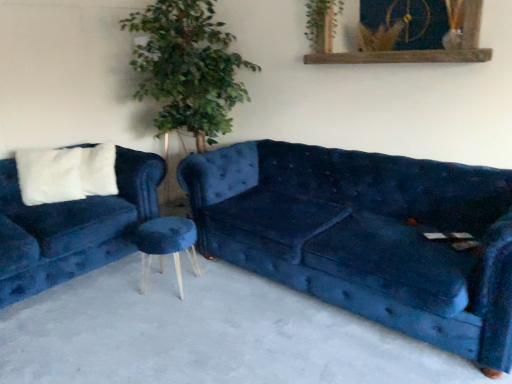
The height and width of the screenshot is (384, 512). What do you see at coordinates (410, 50) in the screenshot? I see `rustic wood picture frame at upper center` at bounding box center [410, 50].

Locate an element on the screen. The height and width of the screenshot is (384, 512). velvet blue stool at center is located at coordinates (166, 246).

The image size is (512, 384). What do you see at coordinates (72, 227) in the screenshot?
I see `velvet blue couch at left, which is the first studio couch from left to right` at bounding box center [72, 227].

Find the location of `rustic wood picture frame at upper center`. rustic wood picture frame at upper center is located at coordinates (410, 50).

Is rustic wood picture frame at upper center thinner than white fluffy pillow at left?

Yes, rustic wood picture frame at upper center is thinner than white fluffy pillow at left.

Measure the distance from rustic wood picture frame at upper center to white fluffy pillow at left.

rustic wood picture frame at upper center and white fluffy pillow at left are 5.69 feet apart.

Could you tell me if rustic wood picture frame at upper center is turned towards white fluffy pillow at left?

No.

Considering the sizes of objects rustic wood picture frame at upper center and white fluffy pillow at left in the image provided, who is taller, rustic wood picture frame at upper center or white fluffy pillow at left?

Standing taller between the two is white fluffy pillow at left.

From a real-world perspective, who is located lower, white fluffy pillow at left or velvet blue couch at center?

velvet blue couch at center, from a real-world perspective.

Is white fluffy pillow at left facing towards velvet blue couch at center?

No, white fluffy pillow at left is not aimed at velvet blue couch at center.

Can you confirm if white fluffy pillow at left is shorter than velvet blue couch at center?

Incorrect, the height of white fluffy pillow at left does not fall short of that of velvet blue couch at center.

This screenshot has height=384, width=512. In the image, there is a white fluffy pillow at left. Find the location of `concrete below it (from a real-world perspective)`. concrete below it (from a real-world perspective) is located at coordinates (206, 334).

Between point (88, 186) and point (195, 275), which one is positioned in front?

Positioned in front is point (195, 275).

Is white fluffy pillow at left positioned with its back to velvet blue stool at center?

No, white fluffy pillow at left is not facing away from velvet blue stool at center.

Based on the photo, what's the angular difference between white fluffy pillow at left and velvet blue stool at center's facing directions?

The angular difference between white fluffy pillow at left and velvet blue stool at center is 22.7 degrees.

In the image, is white fluffy pillow at left on the left side or the right side of velvet blue stool at center?

Based on their positions, white fluffy pillow at left is located to the left of velvet blue stool at center.

Which object is further away from the camera taking this photo, velvet blue couch at left, arranged as the 2th studio couch when viewed from the right, or green leafy plant at upper center?

green leafy plant at upper center is further from the camera.

Considering the positions of points (55, 272) and (321, 3), is point (55, 272) farther from camera compared to point (321, 3)?

That is False.

Locate an element on the screen. The height and width of the screenshot is (384, 512). studio couch located on the left of green leafy plant at upper center is located at coordinates coord(72,227).

Would you say green leafy plant at upper center is part of velvet blue couch at left, which is the first studio couch from left to right,'s contents?

That's incorrect, green leafy plant at upper center is not inside velvet blue couch at left, which is the first studio couch from left to right.

Which is less distant, (51,377) or (351,244)?

The point (51,377) is closer to the camera.

From the picture: Can you confirm if velvet blue couch at center is smaller than velvet blue couch at center, which ranks as the 2th studio couch in left-to-right order?

Yes, velvet blue couch at center is smaller than velvet blue couch at center, which ranks as the 2th studio couch in left-to-right order.

Is velvet blue couch at center facing away from velvet blue couch at center, which ranks as the 2th studio couch in left-to-right order?

No, velvet blue couch at center is not facing away from velvet blue couch at center, which ranks as the 2th studio couch in left-to-right order.

Can we say velvet blue couch at center lies outside velvet blue couch at center, which is the 1th studio couch from right to left?

That's correct, velvet blue couch at center is outside of velvet blue couch at center, which is the 1th studio couch from right to left.

This screenshot has width=512, height=384. In order to click on the 2nd studio couch below when counting from the green leafy plant at upper center (from the image's perspective) in this screenshot , I will do `click(366, 236)`.

Which object is positioned more to the right, velvet blue couch at center, which ranks as the 2th studio couch in left-to-right order, or green leafy plant at upper center?

velvet blue couch at center, which ranks as the 2th studio couch in left-to-right order.

Is velvet blue couch at center, which is the 1th studio couch from right to left, bigger than green leafy plant at upper center?

Yes.

From a real-world perspective, is velvet blue couch at center, which ranks as the 2th studio couch in left-to-right order, positioned above or below green leafy plant at upper center?

From a real-world perspective, velvet blue couch at center, which ranks as the 2th studio couch in left-to-right order, is physically below green leafy plant at upper center.

Can you confirm if rustic wood picture frame at upper center is taller than green leafy plant at upper center?

Yes.

Does rustic wood picture frame at upper center contain green leafy plant at upper center?

Yes, green leafy plant at upper center is surrounded by rustic wood picture frame at upper center.

From the image's perspective, which one is positioned higher, rustic wood picture frame at upper center or green leafy plant at upper center?

From the image's view, green leafy plant at upper center is above.

Is rustic wood picture frame at upper center in front of or behind green leafy plant at upper center in the image?

rustic wood picture frame at upper center is positioned closer to the viewer than green leafy plant at upper center.

The height and width of the screenshot is (384, 512). Identify the location of picture frame on the right of white fluffy pillow at left. (410, 50).

You are a GUI agent. You are given a task and a screenshot of the screen. Output one action in this format:
    pyautogui.click(x=<x>, y=<y>)
    Task: Click on the pillow that appears above the velvet blue couch at center (from the image's perspective)
    
    Given the screenshot: What is the action you would take?
    pyautogui.click(x=98, y=170)

When comparing their distances from white fluffy pillow at left, does velvet blue couch at center, which is the 1th studio couch from right to left, or green leafy plant at upper center seem closer?

velvet blue couch at center, which is the 1th studio couch from right to left, is positioned closer to the anchor white fluffy pillow at left.

Considering their positions, is velvet blue couch at left, which is the first studio couch from left to right, positioned further to velvet blue couch at center than velvet blue stool at center?

The object further to velvet blue couch at center is velvet blue couch at left, which is the first studio couch from left to right.

From the image, which object appears to be farther from green leafy plant at upper center, velvet blue couch at center, which ranks as the 2th studio couch in left-to-right order, or rustic wood picture frame at upper center?

Based on the image, velvet blue couch at center, which ranks as the 2th studio couch in left-to-right order, appears to be further to green leafy plant at upper center.

Which object lies further to the anchor point velvet blue stool at center, white fluffy pillow at left or green leafy plant at upper center?

Based on the image, green leafy plant at upper center appears to be further to velvet blue stool at center.

Estimate the real-world distances between objects in this image. Which object is closer to velvet blue stool at center, velvet blue couch at left, which is the first studio couch from left to right, or green leafy plant at upper center?

velvet blue couch at left, which is the first studio couch from left to right.

Looking at the image, which one is located further to rustic wood picture frame at upper center, white fluffy pillow at left or green leafy plant at upper center?

white fluffy pillow at left lies further to rustic wood picture frame at upper center than the other object.

From the image, which object appears to be nearer to velvet blue couch at center, which ranks as the 2th studio couch in left-to-right order, rustic wood picture frame at upper center or velvet blue couch at center?

velvet blue couch at center lies closer to velvet blue couch at center, which ranks as the 2th studio couch in left-to-right order, than the other object.

Considering their positions, is velvet blue couch at center, which is the 1th studio couch from right to left, positioned further to velvet blue couch at center than white fluffy pillow at left?

Among the two, white fluffy pillow at left is located further to velvet blue couch at center.

This screenshot has height=384, width=512. In order to click on stool between velvet blue couch at left, which is the first studio couch from left to right, and green leafy plant at upper center in this screenshot , I will do `click(166, 246)`.

Identify the location of stool between velvet blue couch at left, arranged as the 2th studio couch when viewed from the right, and rustic wood picture frame at upper center. Image resolution: width=512 pixels, height=384 pixels. (166, 246).

Identify the location of picture frame located between velvet blue couch at center and white fluffy pillow at left in the depth direction. This screenshot has width=512, height=384. (410, 50).

Image resolution: width=512 pixels, height=384 pixels. I want to click on stool situated between white fluffy pillow at left and green leafy plant at upper center from left to right, so click(166, 246).